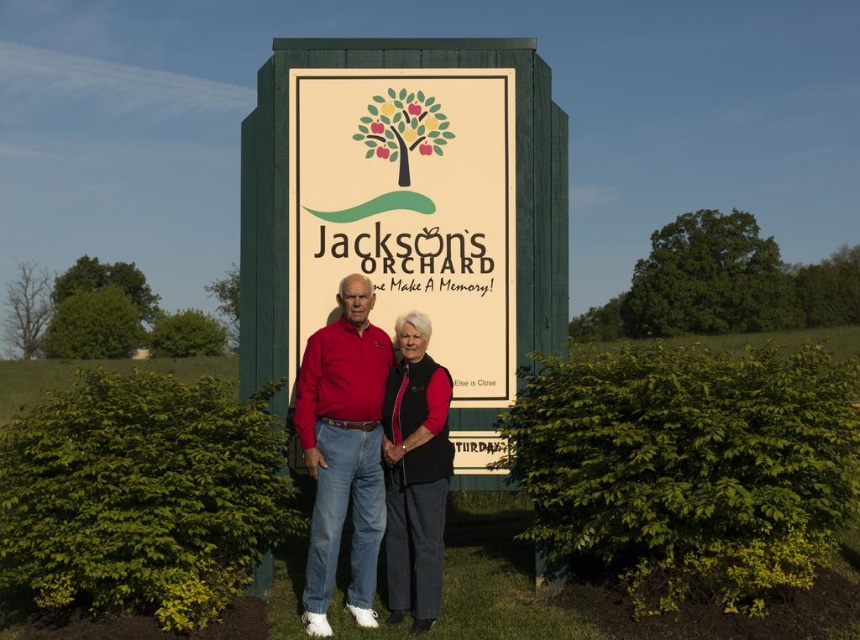
Who is lower down, matte green sign at center or velvet black vest at center?

velvet black vest at center is lower down.

Is point (422, 124) behind point (438, 545)?

Yes.

Is point (295, 108) closer to camera compared to point (422, 448)?

No, (295, 108) is further to viewer.

At what (x,y) coordinates should I click in order to perform the action: click on matte green sign at center. Please return your answer as a coordinate pair (x, y). This screenshot has width=860, height=640. Looking at the image, I should click on (409, 209).

Is point (474, 220) more distant than point (330, 592)?

Yes.

Does point (407, 90) lie behind point (308, 445)?

Yes, point (407, 90) is behind point (308, 445).

In order to click on matte green sign at center in this screenshot , I will do `click(409, 209)`.

Is matte red shirt at center smaller than velvet black vest at center?

Actually, matte red shirt at center might be larger than velvet black vest at center.

Who is more forward, (355, 362) or (390, 492)?

Point (355, 362)

Find the location of a particular element. matte red shirt at center is located at coordinates (344, 451).